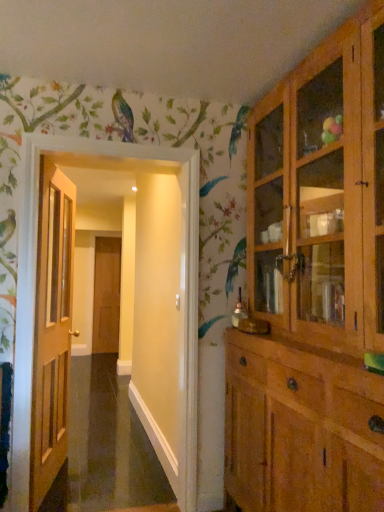
Question: Is light brown wood cabinet at right closer to the viewer compared to wooden door at left, which ranks as the first door in front-to-back order?

Choices:
 (A) no
 (B) yes

Answer: (B)

Question: Does light brown wood cabinet at right have a lesser height compared to wooden door at left, which is the 2th door from left to right?

Choices:
 (A) yes
 (B) no

Answer: (B)

Question: Is light brown wood cabinet at right facing towards wooden door at left, which is the 2th door from left to right?

Choices:
 (A) yes
 (B) no

Answer: (B)

Question: Is light brown wood cabinet at right beside wooden door at left, which is the 2th door from left to right?

Choices:
 (A) no
 (B) yes

Answer: (A)

Question: Can you confirm if light brown wood cabinet at right is thinner than wooden door at left, marked as the first door in a right-to-left arrangement?

Choices:
 (A) no
 (B) yes

Answer: (A)

Question: From a real-world perspective, is brown wooden door at center, marked as the second door in a right-to-left arrangement, above or below wooden door at left, the second door positioned from the back?

Choices:
 (A) above
 (B) below

Answer: (B)

Question: Considering the positions of point (110, 315) and point (59, 370), is point (110, 315) closer or farther from the camera than point (59, 370)?

Choices:
 (A) farther
 (B) closer

Answer: (A)

Question: Is brown wooden door at center, placed as the 2th door when sorted from front to back, bigger or smaller than wooden door at left, the second door positioned from the back?

Choices:
 (A) big
 (B) small

Answer: (B)

Question: Is brown wooden door at center, marked as the 1th door in a left-to-right arrangement, inside the boundaries of wooden door at left, the second door positioned from the back, or outside?

Choices:
 (A) outside
 (B) inside

Answer: (A)

Question: Is wooden door at left, which ranks as the first door in front-to-back order, in front of or behind light brown wood cabinet at right in the image?

Choices:
 (A) front
 (B) behind

Answer: (B)

Question: Is wooden door at left, marked as the first door in a right-to-left arrangement, inside or outside of light brown wood cabinet at right?

Choices:
 (A) outside
 (B) inside

Answer: (A)

Question: Looking at their shapes, would you say wooden door at left, which is the 2th door from left to right, is wider or thinner than light brown wood cabinet at right?

Choices:
 (A) wide
 (B) thin

Answer: (B)

Question: From a real-world perspective, is wooden door at left, marked as the first door in a right-to-left arrangement, physically located above or below light brown wood cabinet at right?

Choices:
 (A) below
 (B) above

Answer: (A)

Question: In terms of height, does light brown wood cabinet at right look taller or shorter compared to brown wooden door at center, the 1th door from the back?

Choices:
 (A) short
 (B) tall

Answer: (B)

Question: Would you say light brown wood cabinet at right is to the left or to the right of brown wooden door at center, placed as the 2th door when sorted from front to back, in the picture?

Choices:
 (A) right
 (B) left

Answer: (A)